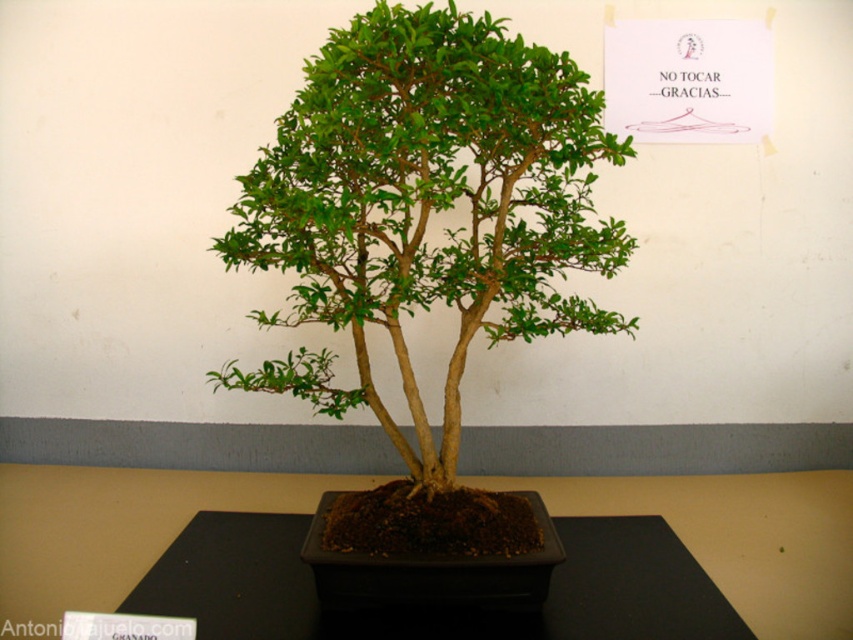
Can you confirm if green matte bonsai tree at center is positioned above black matte table at center?

Yes.

Can you confirm if green matte bonsai tree at center is positioned to the left of black matte table at center?

Yes, green matte bonsai tree at center is to the left of black matte table at center.

What do you see at coordinates (425, 205) in the screenshot? I see `green matte bonsai tree at center` at bounding box center [425, 205].

This screenshot has height=640, width=853. I want to click on green matte bonsai tree at center, so click(x=425, y=205).